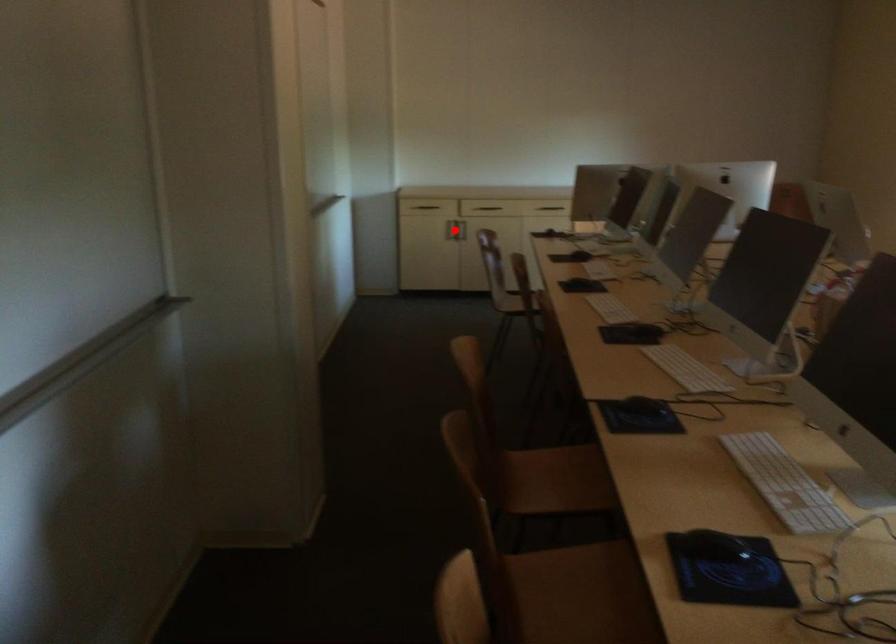
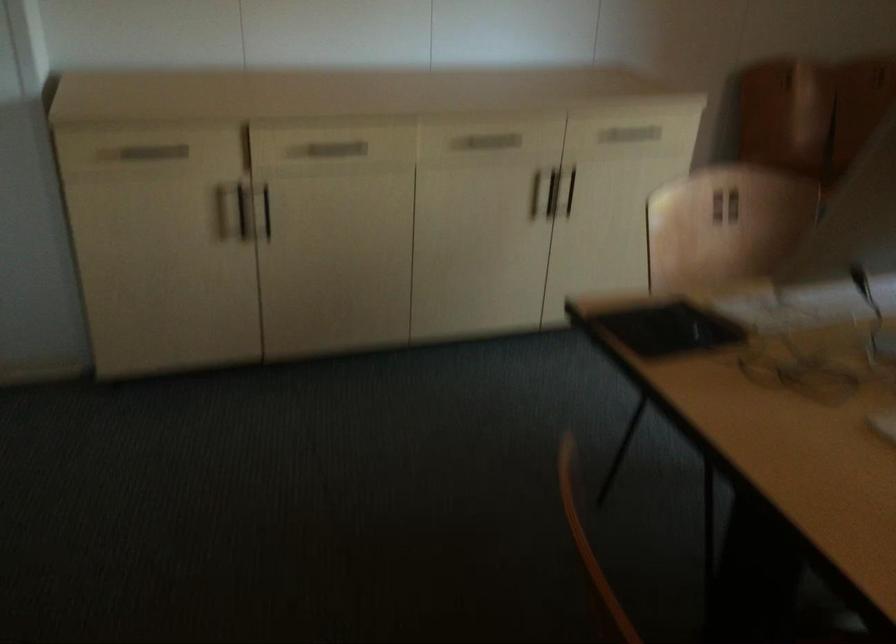
Question: I am providing you with two images of the same scene from different viewpoints. A red point is marked on the first image. At the location where the point appears in image 1, is it still visible in image 2?

Choices:
 (A) Yes
 (B) No

Answer: (B)